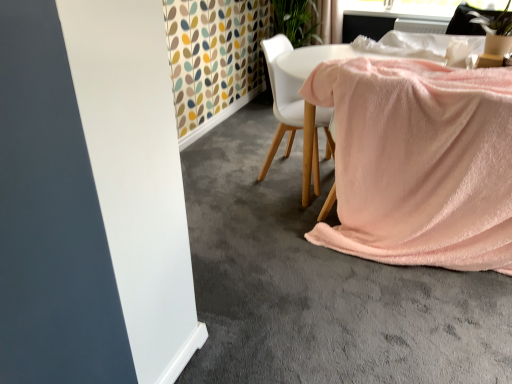
Question: Does white fabric chair at center appear on the left side of pink soft blanket at lower right?

Choices:
 (A) yes
 (B) no

Answer: (A)

Question: Could you tell me if white fabric chair at center is turned towards pink soft blanket at lower right?

Choices:
 (A) yes
 (B) no

Answer: (B)

Question: From a real-world perspective, is white fabric chair at center over pink soft blanket at lower right?

Choices:
 (A) yes
 (B) no

Answer: (A)

Question: Is white fabric chair at center completely or partially outside of pink soft blanket at lower right?

Choices:
 (A) yes
 (B) no

Answer: (A)

Question: Is white fabric chair at center taller than pink soft blanket at lower right?

Choices:
 (A) yes
 (B) no

Answer: (A)

Question: From a real-world perspective, is white fabric chair at center below pink soft blanket at lower right?

Choices:
 (A) yes
 (B) no

Answer: (B)

Question: Does pink soft fabric at center have a greater height compared to green leafy plant at upper right?

Choices:
 (A) yes
 (B) no

Answer: (A)

Question: From a real-world perspective, does pink soft fabric at center stand above green leafy plant at upper right?

Choices:
 (A) yes
 (B) no

Answer: (B)

Question: From the image's perspective, is pink soft fabric at center over green leafy plant at upper right?

Choices:
 (A) no
 (B) yes

Answer: (A)

Question: Are pink soft fabric at center and green leafy plant at upper right beside each other?

Choices:
 (A) yes
 (B) no

Answer: (B)

Question: Does pink soft fabric at center appear on the left side of green leafy plant at upper right?

Choices:
 (A) yes
 (B) no

Answer: (A)

Question: From the image's perspective, is pink soft fabric at center below green leafy plant at upper right?

Choices:
 (A) yes
 (B) no

Answer: (A)

Question: From a real-world perspective, is white fabric chair at center over pink soft fabric at center?

Choices:
 (A) yes
 (B) no

Answer: (A)